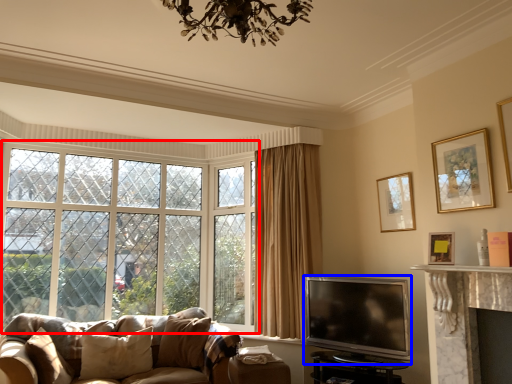
Question: Which point is closer to the camera, window (highlighted by a red box) or television (highlighted by a blue box)?

Choices:
 (A) window
 (B) television

Answer: (B)